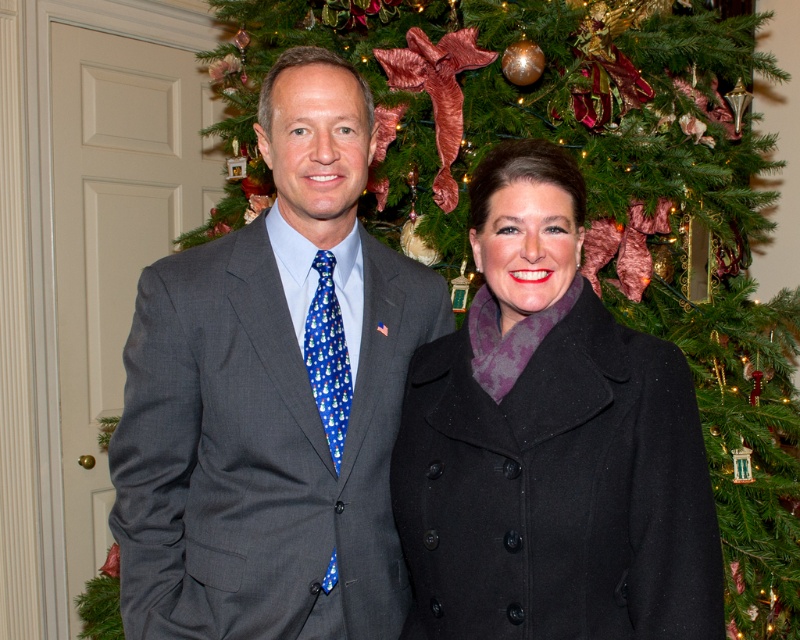
The width and height of the screenshot is (800, 640). What do you see at coordinates (274, 396) in the screenshot? I see `gray suit at center` at bounding box center [274, 396].

Does point (152, 490) lie behind point (644, 538)?

Yes, it is behind point (644, 538).

The image size is (800, 640). Find the location of `gray suit at center`. gray suit at center is located at coordinates (274, 396).